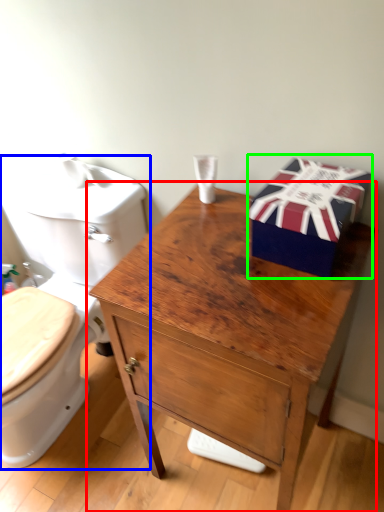
Question: Which is nearer to the table (highlighted by a red box)? toilet (highlighted by a blue box) or gift box (highlighted by a green box).

Choices:
 (A) toilet
 (B) gift box

Answer: (B)